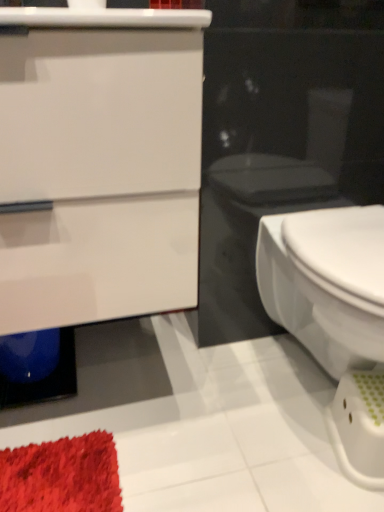
In the scene shown: What is the approximate width of white glossy bidet at right?

21.30 inches.

At what (x,y) coordinates should I click in order to perform the action: click on white glossy bidet at right. Please return your answer as a coordinate pair (x, y). Looking at the image, I should click on (326, 282).

Describe the element at coordinates (326, 282) in the screenshot. I see `white glossy bidet at right` at that location.

The image size is (384, 512). I want to click on white glossy cabinet at upper left, so 99,164.

Describe the element at coordinates (99, 164) in the screenshot. I see `white glossy cabinet at upper left` at that location.

Where is `white glossy bidet at right`? white glossy bidet at right is located at coordinates pyautogui.click(x=326, y=282).

Is white glossy cabinet at upper left to the left of white glossy bidet at right from the viewer's perspective?

Yes, white glossy cabinet at upper left is to the left of white glossy bidet at right.

Does white glossy cabinet at upper left come behind white glossy bidet at right?

No, it is not.

Does point (65, 62) come in front of point (273, 249)?

That is True.

From the image's perspective, who appears lower, white glossy cabinet at upper left or white glossy bidet at right?

white glossy bidet at right.

Consider the image. From a real-world perspective, who is located higher, white glossy cabinet at upper left or white glossy bidet at right?

white glossy cabinet at upper left is physically above.

In terms of width, does white glossy cabinet at upper left look wider or thinner when compared to white glossy bidet at right?

In the image, white glossy cabinet at upper left appears to be more narrow than white glossy bidet at right.

Who is taller, white glossy cabinet at upper left or white glossy bidet at right?

white glossy cabinet at upper left.

Consider the image. Who is smaller, white glossy cabinet at upper left or white glossy bidet at right?

white glossy bidet at right is smaller.

Would you say white glossy cabinet at upper left is outside white glossy bidet at right?

Indeed, white glossy cabinet at upper left is completely outside white glossy bidet at right.

Are white glossy cabinet at upper left and white glossy bidet at right located far from each other?

No, white glossy cabinet at upper left is not far away from white glossy bidet at right.

Is white glossy cabinet at upper left looking in the opposite direction of white glossy bidet at right?

white glossy cabinet at upper left does not have its back to white glossy bidet at right.

What's the angular difference between white glossy cabinet at upper left and white glossy bidet at right's facing directions?

1.48 degrees separate the facing orientations of white glossy cabinet at upper left and white glossy bidet at right.

Where is `bidet on the right of white glossy cabinet at upper left`? bidet on the right of white glossy cabinet at upper left is located at coordinates pos(326,282).

Which object is positioned more to the right, white glossy bidet at right or white glossy cabinet at upper left?

From the viewer's perspective, white glossy bidet at right appears more on the right side.

Is white glossy bidet at right in front of or behind white glossy cabinet at upper left in the image?

white glossy bidet at right is positioned farther from the viewer than white glossy cabinet at upper left.

Is point (325, 366) farther from camera compared to point (172, 266)?

That is True.

From the image's perspective, who appears lower, white glossy bidet at right or white glossy cabinet at upper left?

white glossy bidet at right appears lower in the image.

In the scene shown: From a real-world perspective, is white glossy bidet at right located higher than white glossy cabinet at upper left?

Actually, white glossy bidet at right is physically below white glossy cabinet at upper left in the real world.

Which of these two, white glossy bidet at right or white glossy cabinet at upper left, is wider?

white glossy bidet at right.

Who is shorter, white glossy bidet at right or white glossy cabinet at upper left?

Standing shorter between the two is white glossy bidet at right.

Which of these two, white glossy bidet at right or white glossy cabinet at upper left, is smaller?

white glossy bidet at right.

Is white glossy bidet at right completely or partially outside of white glossy cabinet at upper left?

Indeed, white glossy bidet at right is completely outside white glossy cabinet at upper left.

Is white glossy bidet at right not near white glossy cabinet at upper left?

No, white glossy bidet at right is not far away from white glossy cabinet at upper left.

Is white glossy bidet at right turned away from white glossy cabinet at upper left?

No, white glossy bidet at right's orientation is not away from white glossy cabinet at upper left.

How different are the orientations of white glossy bidet at right and white glossy cabinet at upper left in degrees?

The facing directions of white glossy bidet at right and white glossy cabinet at upper left are 1.48 degrees apart.

In the scene shown: How far apart are white glossy bidet at right and white glossy cabinet at upper left?

white glossy bidet at right and white glossy cabinet at upper left are 15.42 inches apart from each other.

Where is `bathroom cabinet to the left of white glossy bidet at right`? The image size is (384, 512). bathroom cabinet to the left of white glossy bidet at right is located at coordinates coord(99,164).

In order to click on bidet that is under the white glossy cabinet at upper left (from a real-world perspective) in this screenshot , I will do `click(326, 282)`.

Where is `bidet on the right side of white glossy cabinet at upper left`? bidet on the right side of white glossy cabinet at upper left is located at coordinates point(326,282).